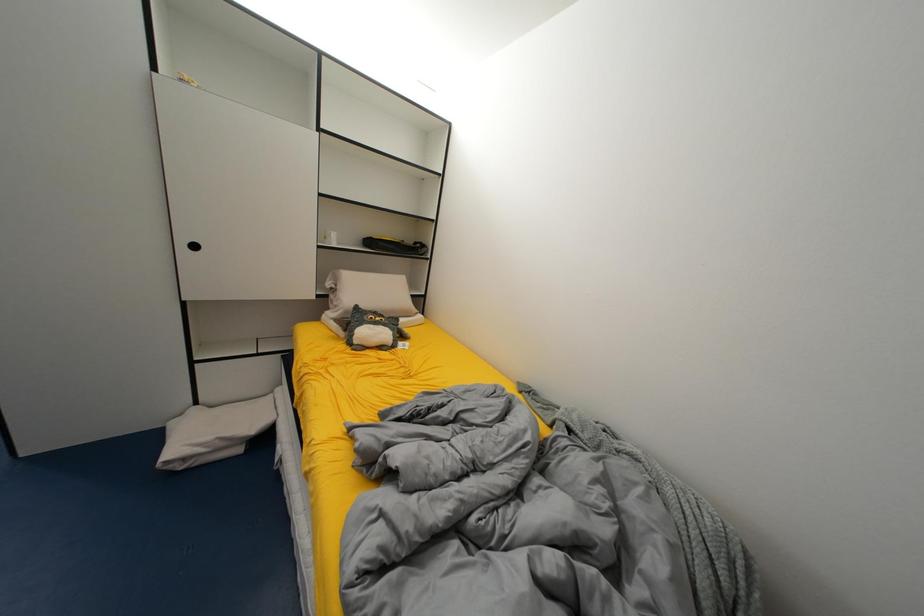
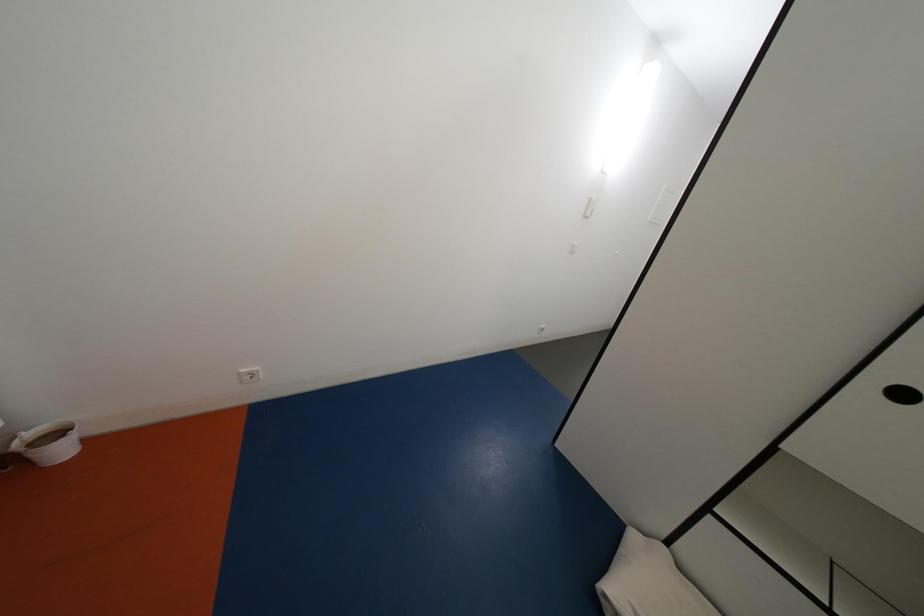
Question: The camera is either moving clockwise (left) or counter-clockwise (right) around the object. The first image is from the beginning of the video and the second image is from the end. Is the camera moving left or right when shooting the video?

Choices:
 (A) Left
 (B) Right

Answer: (B)